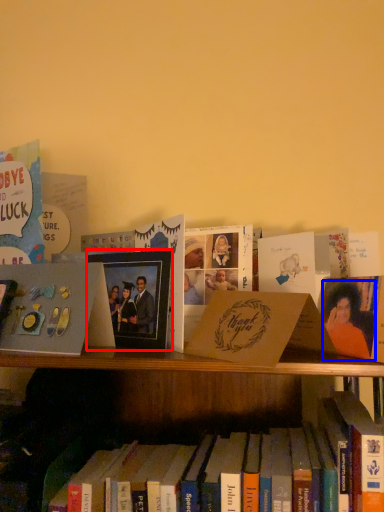
Question: Which point is closer to the camera, picture frame (highlighted by a red box) or person (highlighted by a blue box)?

Choices:
 (A) picture frame
 (B) person

Answer: (B)